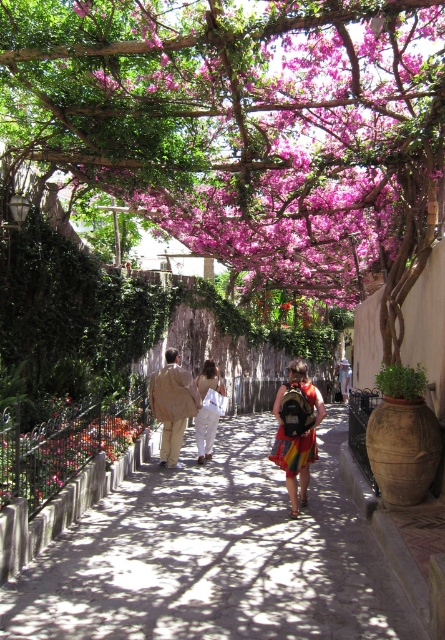
Question: Which point appears closest to the camera in this image?

Choices:
 (A) (190, 387)
 (B) (415, 209)
 (C) (279, 401)
 (D) (116, 554)

Answer: (D)

Question: Which point is closer to the camera?

Choices:
 (A) smooth concrete path at center
 (B) rainbow fabric dress at center
 (C) purple matte flowers at upper center

Answer: (A)

Question: Can you confirm if rainbow fabric dress at center is bigger than beige fabric jacket at center?

Choices:
 (A) yes
 (B) no

Answer: (A)

Question: Which point is closer to the camera taking this photo?

Choices:
 (A) (350, 540)
 (B) (27, 445)
 (C) (282, 440)

Answer: (B)

Question: Can you confirm if smooth concrete path at center is smaller than rainbow fabric dress at center?

Choices:
 (A) no
 (B) yes

Answer: (B)

Question: Can you confirm if smooth concrete path at center is bigger than floral patterned vase at lower left?

Choices:
 (A) yes
 (B) no

Answer: (A)